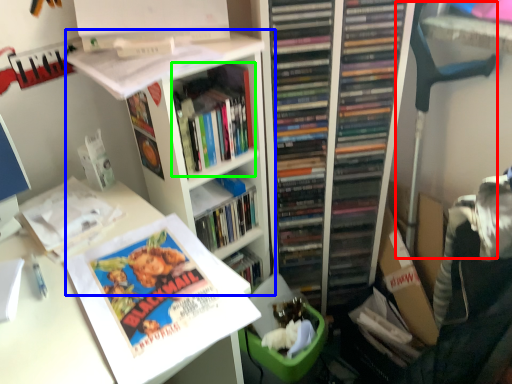
Question: Which object is positioned closest to computer chair (highlighted by a red box)? Select from bookshelf (highlighted by a blue box) and book (highlighted by a green box).

Choices:
 (A) bookshelf
 (B) book

Answer: (B)